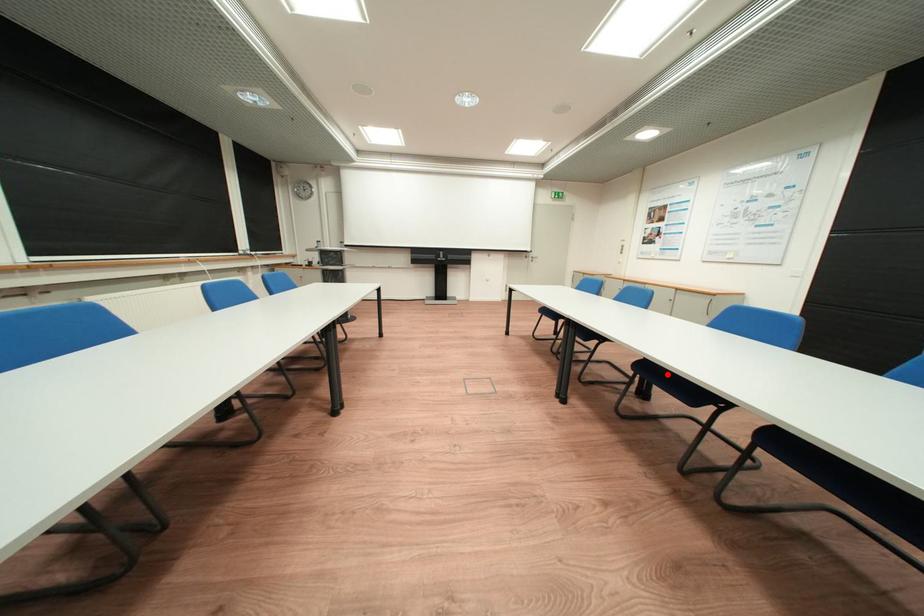
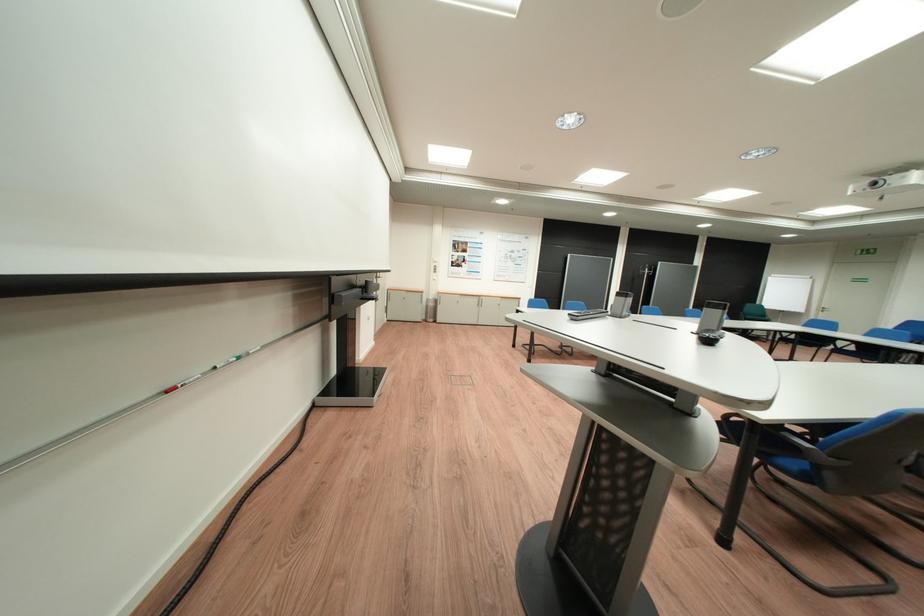
Question: I am providing you with two images of the same scene from different viewpoints. A red point is marked on the first image. Is the red point's position out of view in image 2?

Choices:
 (A) Yes
 (B) No

Answer: (A)